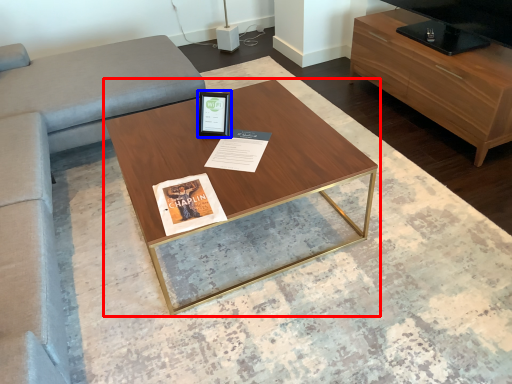
Question: Among these objects, which one is nearest to the camera, coffee table (highlighted by a red box) or picture frame (highlighted by a blue box)?

Choices:
 (A) coffee table
 (B) picture frame

Answer: (A)